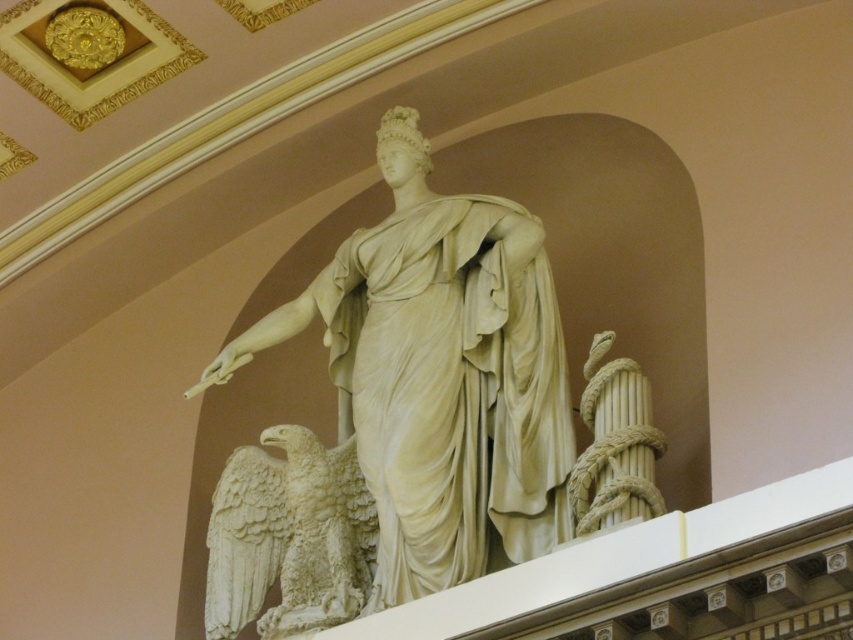
Question: Does white marble statue at center appear on the left side of white marble eagle at lower left?

Choices:
 (A) no
 (B) yes

Answer: (A)

Question: Where is white marble statue at center located in relation to white marble eagle at lower left in the image?

Choices:
 (A) above
 (B) below

Answer: (A)

Question: Which point is closer to the camera taking this photo?

Choices:
 (A) pyautogui.click(x=315, y=627)
 (B) pyautogui.click(x=409, y=282)

Answer: (A)

Question: Which of the following is the closest to the observer?

Choices:
 (A) (415, 227)
 (B) (339, 609)

Answer: (B)

Question: Does white marble statue at center have a greater width compared to white marble eagle at lower left?

Choices:
 (A) yes
 (B) no

Answer: (A)